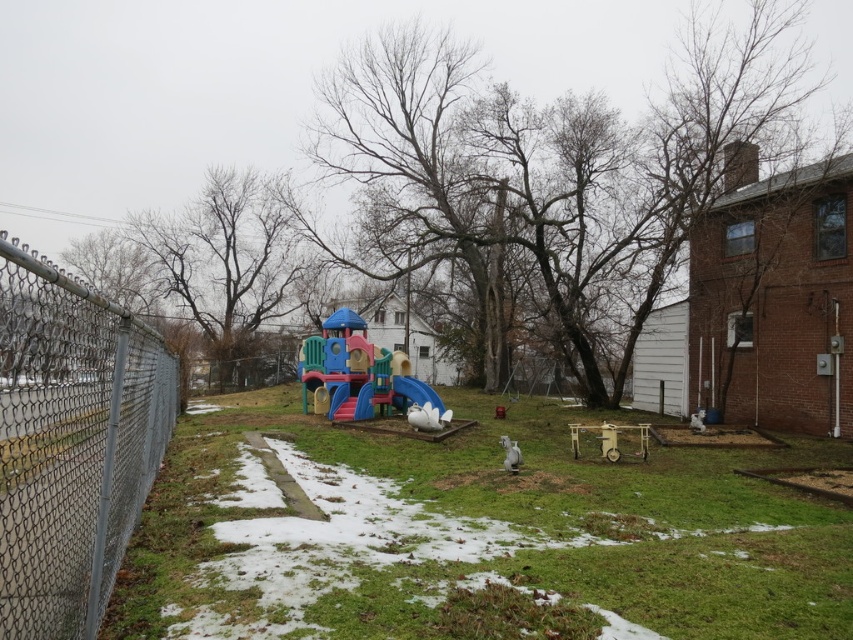
Is green grass at center smaller than smooth plastic slide at center?

No, green grass at center is not smaller than smooth plastic slide at center.

Which is more to the right, green grass at center or smooth plastic slide at center?

From the viewer's perspective, green grass at center appears more on the right side.

Where is `green grass at center`? green grass at center is located at coordinates (474, 536).

Locate an element on the screen. The image size is (853, 640). green grass at center is located at coordinates (474, 536).

Is green grass at center bigger than gray chain-link fence at left?

Yes.

Does green grass at center have a smaller size compared to gray chain-link fence at left?

Incorrect, green grass at center is not smaller in size than gray chain-link fence at left.

Who is more distant from viewer, (538, 522) or (164, 416)?

Point (164, 416)

At what (x,y) coordinates should I click in order to perform the action: click on green grass at center. Please return your answer as a coordinate pair (x, y). Looking at the image, I should click on (474, 536).

Is green grass at center above multicolored plastic playground at center?

Incorrect, green grass at center is not positioned above multicolored plastic playground at center.

Can you confirm if green grass at center is taller than multicolored plastic playground at center?

In fact, green grass at center may be shorter than multicolored plastic playground at center.

Which is behind, point (416, 465) or point (355, 416)?

Positioned behind is point (355, 416).

Image resolution: width=853 pixels, height=640 pixels. Find the location of `green grass at center`. green grass at center is located at coordinates (474, 536).